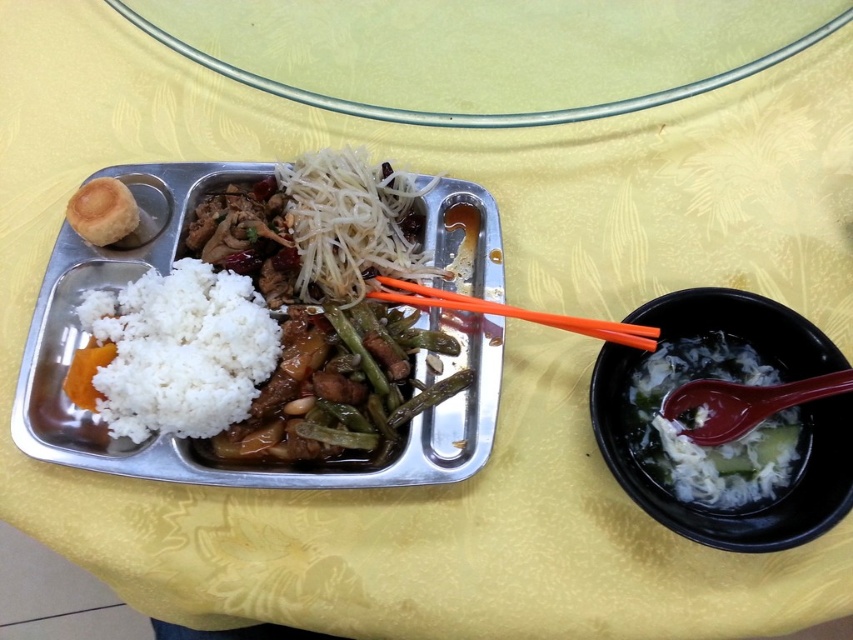
You are a food critic evaluating the presentation of this meal. The transparent glass plate at upper center and the white matte rice at center are both part of the dish. Which object is shorter in height?

The transparent glass plate at upper center is not as tall as the white matte rice at center, so the transparent glass plate at upper center is shorter in height.

You are a food delivery robot that needs to place a new dish on the metal tray. The robot can only place items within a 0.1 unit radius of the transparent glass plate at upper center. Where should the robot place the new dish?

The robot should place the new dish near the transparent glass plate at upper center, specifically within the 0.1 unit radius around the point at coordinates (485, 51).